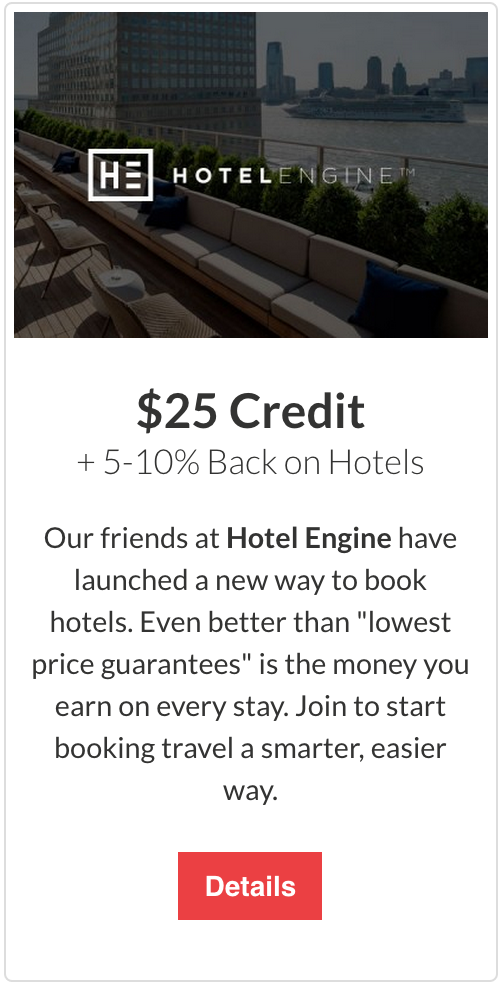
Find the location of `pillow`. pillow is located at coordinates (179, 209).